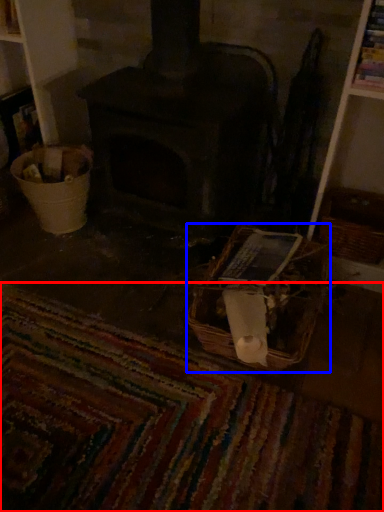
Question: Which object appears farthest to the camera in this image, mat (highlighted by a red box) or basket (highlighted by a blue box)?

Choices:
 (A) mat
 (B) basket

Answer: (B)